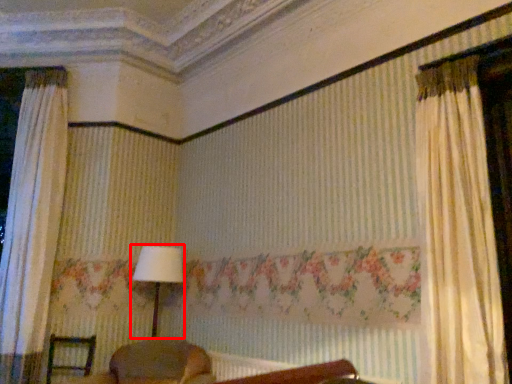
Question: Observing the image, what is the correct spatial positioning of table lamp (annotated by the red box) in reference to furniture?

Choices:
 (A) right
 (B) left

Answer: (A)